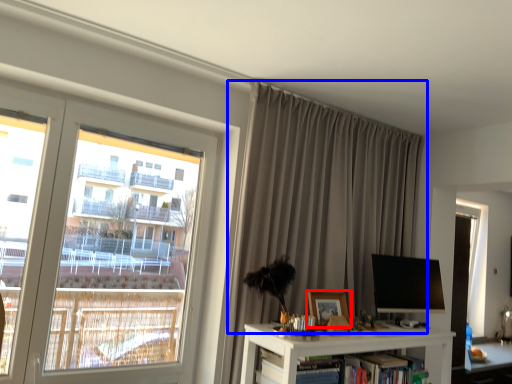
Question: Among these objects, which one is nearest to the camera, picture frame (highlighted by a red box) or curtain (highlighted by a blue box)?

Choices:
 (A) picture frame
 (B) curtain

Answer: (B)